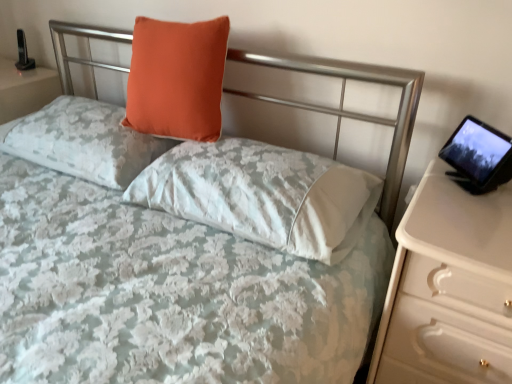
What do you see at coordinates (262, 195) in the screenshot?
I see `orange fabric pillow at upper center, the first pillow in the right-to-left sequence` at bounding box center [262, 195].

You are a GUI agent. You are given a task and a screenshot of the screen. Output one action in this format:
    pyautogui.click(x=<x>, y=<y>)
    Task: Click on the black glossy tablet at right
    Image resolution: width=512 pixels, height=384 pixels.
    Given the screenshot: What is the action you would take?
    pyautogui.click(x=479, y=153)

Is white glossy nightstand at right outside of matte orange pillow at upper left, which ranks as the 3th pillow in right-to-left order?

white glossy nightstand at right is positioned outside matte orange pillow at upper left, which ranks as the 3th pillow in right-to-left order.

Is white glossy nightstand at right in front of or behind matte orange pillow at upper left, placed as the first pillow when sorted from left to right, in the image?

white glossy nightstand at right is positioned closer to the viewer than matte orange pillow at upper left, placed as the first pillow when sorted from left to right.

From the image's perspective, is white glossy nightstand at right located beneath matte orange pillow at upper left, which ranks as the 3th pillow in right-to-left order?

Yes, from the image's perspective, white glossy nightstand at right is beneath matte orange pillow at upper left, which ranks as the 3th pillow in right-to-left order.

Considering the relative sizes of orange fabric pillow at upper center, the 3th pillow when ordered from left to right, and white glossy nightstand at right in the image provided, is orange fabric pillow at upper center, the 3th pillow when ordered from left to right, wider than white glossy nightstand at right?

Incorrect, the width of orange fabric pillow at upper center, the 3th pillow when ordered from left to right, does not surpass that of white glossy nightstand at right.

From the image's perspective, between orange fabric pillow at upper center, the 3th pillow when ordered from left to right, and white glossy nightstand at right, who is located below?

white glossy nightstand at right, from the image's perspective.

Considering the positions of objects orange fabric pillow at upper center, the 3th pillow when ordered from left to right, and white glossy nightstand at right in the image provided, who is more to the left, orange fabric pillow at upper center, the 3th pillow when ordered from left to right, or white glossy nightstand at right?

Positioned to the left is orange fabric pillow at upper center, the 3th pillow when ordered from left to right.

Which is farther, (342, 212) or (497, 235)?

Positioned behind is point (342, 212).

Is black glossy tablet at right at the back of matte orange pillow at upper left, which ranks as the 3th pillow in right-to-left order?

No, matte orange pillow at upper left, which ranks as the 3th pillow in right-to-left order, is not facing the opposite direction of black glossy tablet at right.

Does matte orange pillow at upper left, which ranks as the 3th pillow in right-to-left order, have a larger size compared to black glossy tablet at right?

Yes.

From the image's perspective, between matte orange pillow at upper left, placed as the first pillow when sorted from left to right, and black glossy tablet at right, who is located below?

black glossy tablet at right appears lower in the image.

Considering the relative sizes of matte orange pillow at upper left, which ranks as the 3th pillow in right-to-left order, and black glossy tablet at right in the image provided, is matte orange pillow at upper left, which ranks as the 3th pillow in right-to-left order, shorter than black glossy tablet at right?

No, matte orange pillow at upper left, which ranks as the 3th pillow in right-to-left order, is not shorter than black glossy tablet at right.

Considering the sizes of objects orange fabric pillow at upper center, the first pillow in the right-to-left sequence, and orange velvet pillow at upper center, which is the 2th pillow from right to left, in the image provided, who is smaller, orange fabric pillow at upper center, the first pillow in the right-to-left sequence, or orange velvet pillow at upper center, which is the 2th pillow from right to left,?

Smaller between the two is orange velvet pillow at upper center, which is the 2th pillow from right to left.

Is orange fabric pillow at upper center, the 3th pillow when ordered from left to right, not close to orange velvet pillow at upper center, which is the 2th pillow from right to left?

No.

From the image's perspective, is orange fabric pillow at upper center, the first pillow in the right-to-left sequence, located above orange velvet pillow at upper center, the second pillow in the left-to-right sequence?

Actually, orange fabric pillow at upper center, the first pillow in the right-to-left sequence, appears below orange velvet pillow at upper center, the second pillow in the left-to-right sequence, in the image.

Considering the relative positions of orange fabric pillow at upper center, the first pillow in the right-to-left sequence, and black glossy tablet at right in the image provided, is orange fabric pillow at upper center, the first pillow in the right-to-left sequence, to the right of black glossy tablet at right from the viewer's perspective?

No, orange fabric pillow at upper center, the first pillow in the right-to-left sequence, is not to the right of black glossy tablet at right.

Considering the positions of objects orange fabric pillow at upper center, the 3th pillow when ordered from left to right, and black glossy tablet at right in the image provided, who is in front, orange fabric pillow at upper center, the 3th pillow when ordered from left to right, or black glossy tablet at right?

orange fabric pillow at upper center, the 3th pillow when ordered from left to right, is closer to the camera.

In the scene shown: How many degrees apart are the facing directions of orange fabric pillow at upper center, the 3th pillow when ordered from left to right, and black glossy tablet at right?

There is a 52.4-degree angle between the facing directions of orange fabric pillow at upper center, the 3th pillow when ordered from left to right, and black glossy tablet at right.

From a real-world perspective, does white glossy nightstand at right stand above orange fabric pillow at upper center, the 3th pillow when ordered from left to right?

Answer: No, from a real-world perspective, white glossy nightstand at right is not on top of orange fabric pillow at upper center, the 3th pillow when ordered from left to right.

Where is `pillow that is the 1st object located behind the white glossy nightstand at right`? This screenshot has height=384, width=512. pillow that is the 1st object located behind the white glossy nightstand at right is located at coordinates (262, 195).

Is white glossy nightstand at right facing away from orange fabric pillow at upper center, the 3th pillow when ordered from left to right?

white glossy nightstand at right is not turned away from orange fabric pillow at upper center, the 3th pillow when ordered from left to right.

Considering the relative positions of white glossy nightstand at right and orange fabric pillow at upper center, the 3th pillow when ordered from left to right, in the image provided, is white glossy nightstand at right to the left of orange fabric pillow at upper center, the 3th pillow when ordered from left to right, from the viewer's perspective?

No, white glossy nightstand at right is not to the left of orange fabric pillow at upper center, the 3th pillow when ordered from left to right.

How different are the orientations of matte orange pillow at upper left, which ranks as the 3th pillow in right-to-left order, and orange fabric pillow at upper center, the first pillow in the right-to-left sequence, in degrees?

matte orange pillow at upper left, which ranks as the 3th pillow in right-to-left order, and orange fabric pillow at upper center, the first pillow in the right-to-left sequence, are facing 0.845 degrees away from each other.

In the image, is matte orange pillow at upper left, which ranks as the 3th pillow in right-to-left order, on the left side or the right side of orange fabric pillow at upper center, the 3th pillow when ordered from left to right?

Clearly, matte orange pillow at upper left, which ranks as the 3th pillow in right-to-left order, is on the left of orange fabric pillow at upper center, the 3th pillow when ordered from left to right, in the image.

Are matte orange pillow at upper left, which ranks as the 3th pillow in right-to-left order, and orange fabric pillow at upper center, the first pillow in the right-to-left sequence, making contact?

There is a gap between matte orange pillow at upper left, which ranks as the 3th pillow in right-to-left order, and orange fabric pillow at upper center, the first pillow in the right-to-left sequence.

Is orange fabric pillow at upper center, the first pillow in the right-to-left sequence, a part of matte orange pillow at upper left, which ranks as the 3th pillow in right-to-left order?

No.

From the image's perspective, starting from the white glossy nightstand at right, which pillow is the 2nd one above? Please provide its 2D coordinates.

[(83, 141)]

Locate an element on the screen. the 1st pillow to the left of the white glossy nightstand at right, counting from the anchor's position is located at coordinates (262, 195).

Consider the image. When comparing their distances from black glossy tablet at right, does orange fabric pillow at upper center, the first pillow in the right-to-left sequence, or orange velvet pillow at upper center, which is the 2th pillow from right to left, seem further?

The object further to black glossy tablet at right is orange velvet pillow at upper center, which is the 2th pillow from right to left.

Consider the image. Based on their spatial positions, is matte orange pillow at upper left, which ranks as the 3th pillow in right-to-left order, or black glossy tablet at right further from orange velvet pillow at upper center, which is the 2th pillow from right to left?

black glossy tablet at right lies further to orange velvet pillow at upper center, which is the 2th pillow from right to left, than the other object.

Considering their positions, is white glossy nightstand at right positioned further to matte orange pillow at upper left, placed as the first pillow when sorted from left to right, than orange fabric pillow at upper center, the 3th pillow when ordered from left to right?

white glossy nightstand at right lies further to matte orange pillow at upper left, placed as the first pillow when sorted from left to right, than the other object.

Estimate the real-world distances between objects in this image. Which object is closer to matte orange pillow at upper left, which ranks as the 3th pillow in right-to-left order, white glossy nightstand at right or orange velvet pillow at upper center, which is the 2th pillow from right to left?

The object closer to matte orange pillow at upper left, which ranks as the 3th pillow in right-to-left order, is orange velvet pillow at upper center, which is the 2th pillow from right to left.

Considering their positions, is black glossy tablet at right positioned closer to orange fabric pillow at upper center, the first pillow in the right-to-left sequence, than white glossy nightstand at right?

Among the two, white glossy nightstand at right is located nearer to orange fabric pillow at upper center, the first pillow in the right-to-left sequence.

In the scene shown: Considering their positions, is orange velvet pillow at upper center, the second pillow in the left-to-right sequence, positioned closer to black glossy tablet at right than white glossy nightstand at right?

white glossy nightstand at right.

Which object lies nearer to the anchor point orange fabric pillow at upper center, the 3th pillow when ordered from left to right, black glossy tablet at right or orange velvet pillow at upper center, which is the 2th pillow from right to left?

orange velvet pillow at upper center, which is the 2th pillow from right to left, is positioned closer to the anchor orange fabric pillow at upper center, the 3th pillow when ordered from left to right.

Looking at the image, which one is located further to orange velvet pillow at upper center, which is the 2th pillow from right to left, orange fabric pillow at upper center, the first pillow in the right-to-left sequence, or black glossy tablet at right?

black glossy tablet at right is positioned further to the anchor orange velvet pillow at upper center, which is the 2th pillow from right to left.

In order to click on pillow located between orange velvet pillow at upper center, which is the 2th pillow from right to left, and black glossy tablet at right in the left-right direction in this screenshot , I will do `click(262, 195)`.

Identify the location of computer screen situated between orange velvet pillow at upper center, which is the 2th pillow from right to left, and white glossy nightstand at right from left to right. This screenshot has height=384, width=512. (479, 153).

Identify the location of pillow between matte orange pillow at upper left, which ranks as the 3th pillow in right-to-left order, and orange fabric pillow at upper center, the first pillow in the right-to-left sequence. (177, 78).

What are the coordinates of `computer screen between orange fabric pillow at upper center, the first pillow in the right-to-left sequence, and white glossy nightstand at right` in the screenshot? It's located at (479, 153).